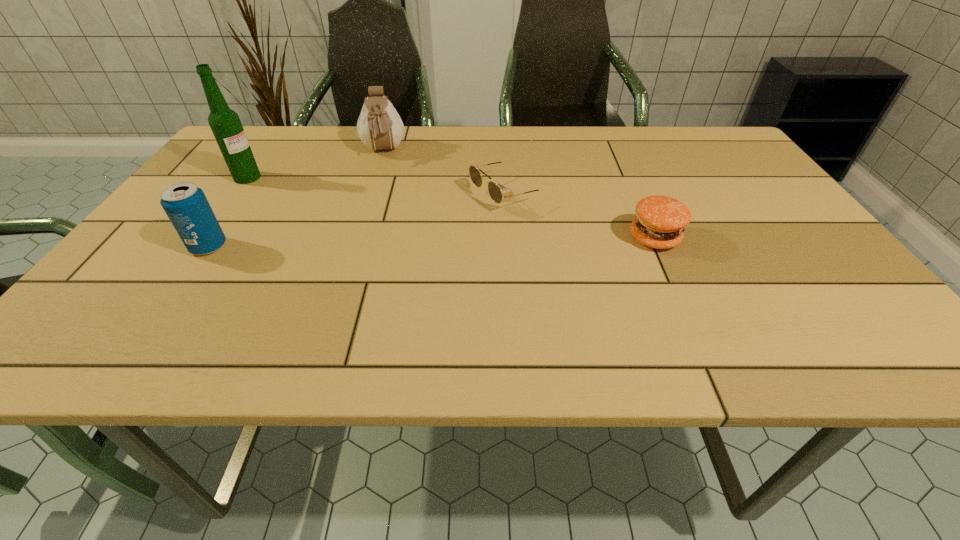
Locate an element on the screen. vacant space on the desktop that is between the third shortest object and the patty and is positioned on the front lenses of the sunglasses is located at coordinates (372, 244).

You are a GUI agent. You are given a task and a screenshot of the screen. Output one action in this format:
    pyautogui.click(x=<x>, y=<y>)
    Task: Click on the vacant spot on the desktop that is between the soda can and the patty and is positioned on the front-facing side of the pouch
    Image resolution: width=960 pixels, height=540 pixels.
    Given the screenshot: What is the action you would take?
    pyautogui.click(x=392, y=243)

Locate an element on the screen. The height and width of the screenshot is (540, 960). free space on the desktop that is between the soda can and the patty and is positioned on the label of the tallest object is located at coordinates (410, 243).